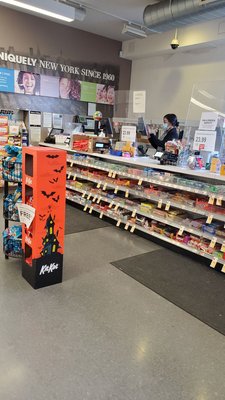
You are a GUI agent. You are given a task and a screenshot of the screen. Output one action in this format:
    pyautogui.click(x=<x>, y=<y>)
    Task: Click on the light
    The width and height of the screenshot is (225, 400).
    Given the screenshot: What is the action you would take?
    pyautogui.click(x=49, y=13)